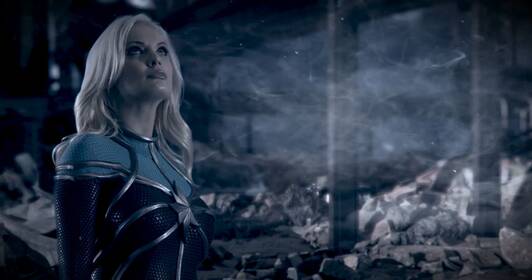
Where is `pillar`? This screenshot has height=280, width=532. pillar is located at coordinates (343, 108), (490, 130), (55, 33).